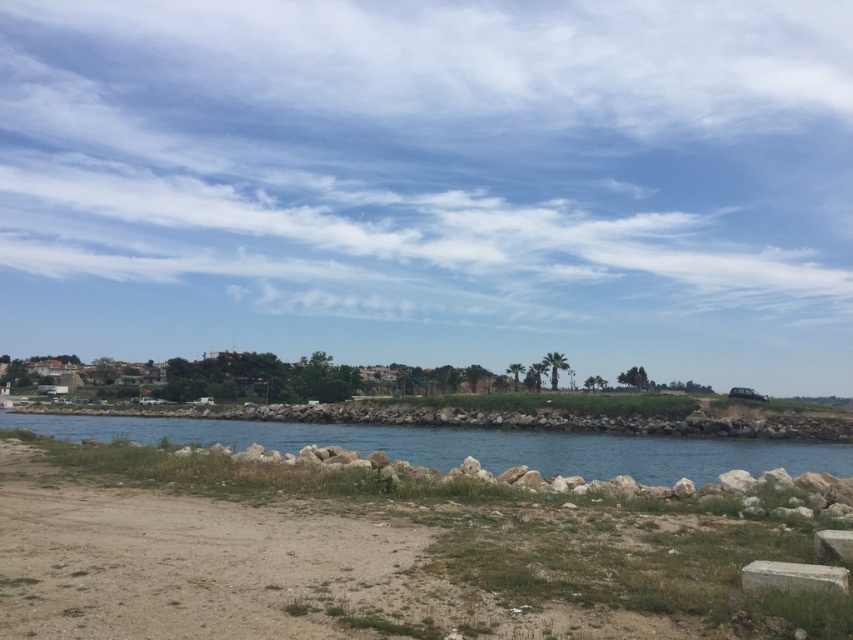
Question: Which of these objects is positioned farthest from the blue stone water at center?

Choices:
 (A) dull brown dirt at lower left
 (B) white marble stone at lower right

Answer: (B)

Question: Does dull brown dirt at lower left come behind blue stone water at center?

Choices:
 (A) yes
 (B) no

Answer: (B)

Question: Can you confirm if dull brown dirt at lower left is thinner than blue stone water at center?

Choices:
 (A) yes
 (B) no

Answer: (A)

Question: Considering the relative positions of dull brown dirt at lower left and blue stone water at center in the image provided, where is dull brown dirt at lower left located with respect to blue stone water at center?

Choices:
 (A) below
 (B) above

Answer: (B)

Question: Which object is farther from the camera taking this photo?

Choices:
 (A) white marble stone at lower right
 (B) dull brown dirt at lower left

Answer: (A)

Question: Among these objects, which one is farthest from the camera?

Choices:
 (A) dull brown dirt at lower left
 (B) white marble stone at lower right
 (C) blue stone water at center

Answer: (C)